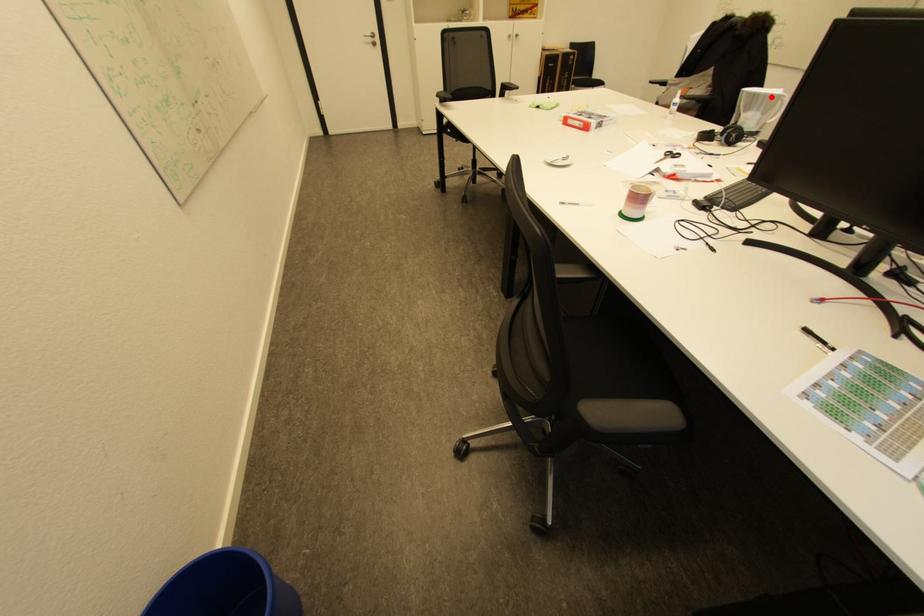
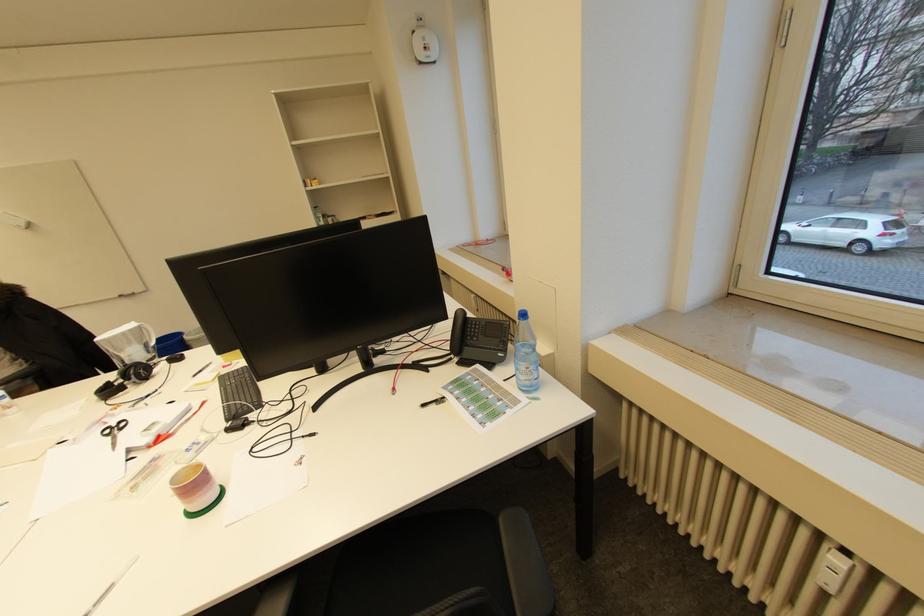
Find the pixel in the second image that matches the highlighted location in the first image.

(129, 334)